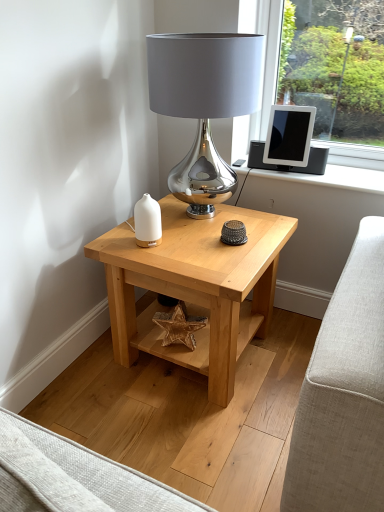
Where is `free space in front of satin silver lamp at center`? free space in front of satin silver lamp at center is located at coordinates (199, 253).